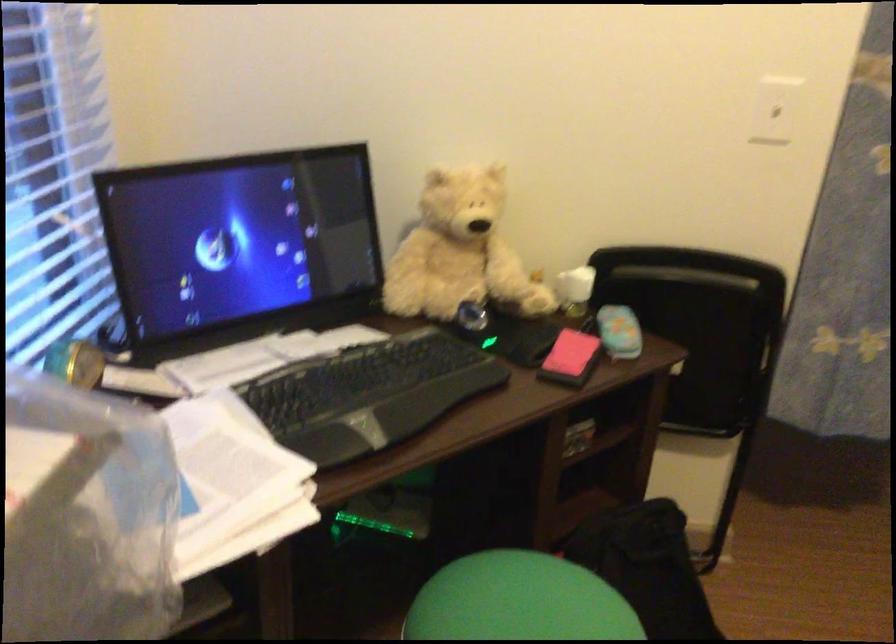
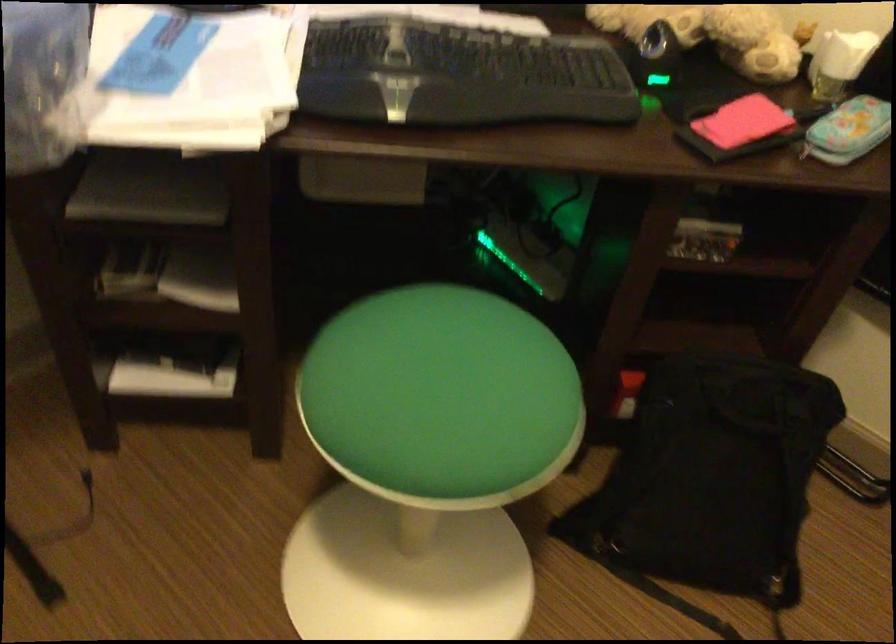
Question: I am providing you with two images of the same scene from different viewpoints. Please identify which objects are invisible in image2.

Choices:
 (A) black backpack strap
 (B) small glass cup
 (C) black computer mouse
 (D) none of these

Answer: (D)